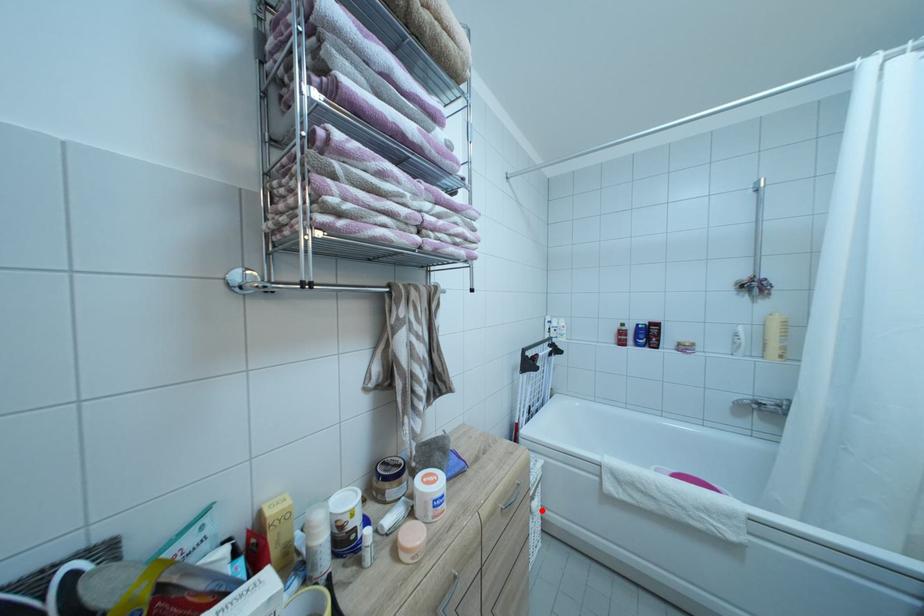
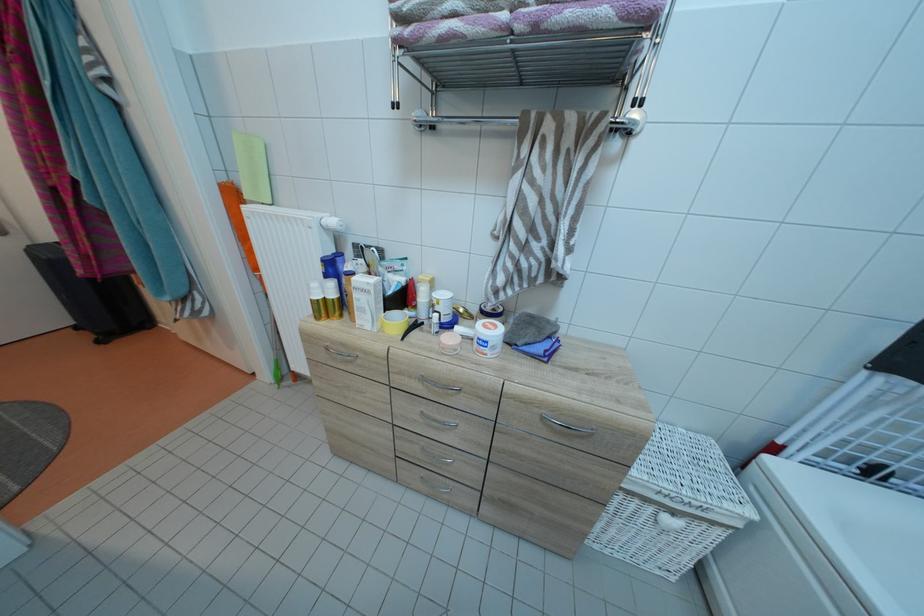
Find the pixel in the second image that matches the highlighted location in the first image.

(675, 525)